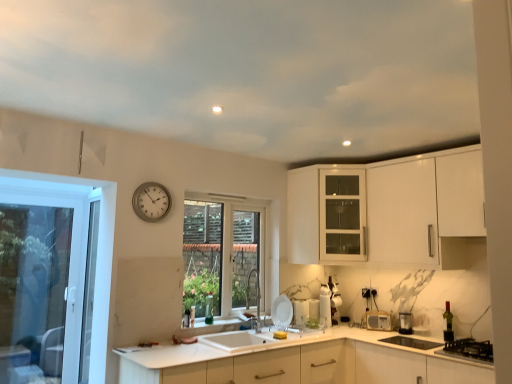
This screenshot has height=384, width=512. I want to click on vacant region above transparent glass door at left, marked as the 1th window in a left-to-right arrangement (from a real-world perspective), so click(x=57, y=193).